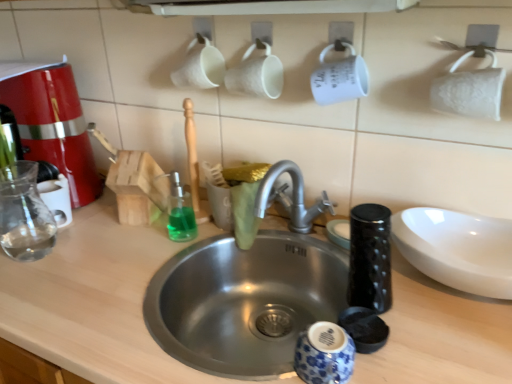
Identify the location of free space to the left of green translucent liquid at sink. The image size is (512, 384). (116, 244).